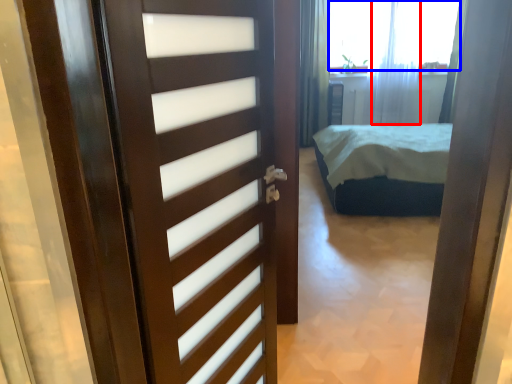
Question: Which object is further to the camera taking this photo, curtain (highlighted by a red box) or window screen (highlighted by a blue box)?

Choices:
 (A) curtain
 (B) window screen

Answer: (B)